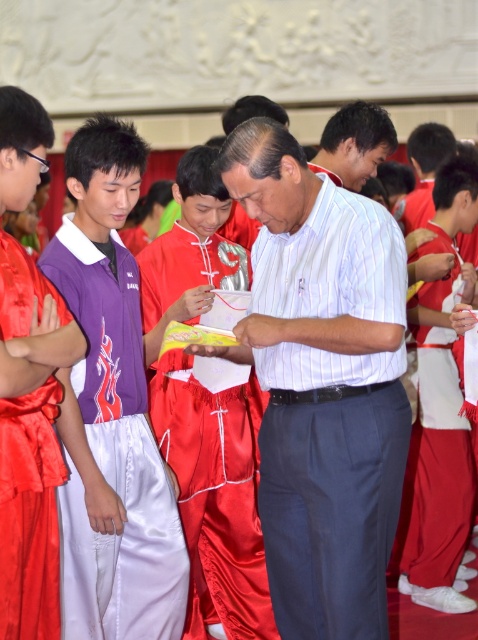
You are standing in the hall and want to take a photo of the point at coordinates (x=11, y=257). The camera you are using has a maximum focus range of 20 meters. Will the camera be able to focus on the point?

The point at coordinates (x=11, y=257) is 23.43 meters away from the camera, which exceeds the camera maximum focus range of 20 meters. Therefore, the camera will not be able to focus on the point.

You are a photographer positioned at the back of the hall. You want to capture a photo of both the silky red robe at left and the matte white shirt at center without any obstruction. Which object should you focus on first to ensure it appears sharp in the photo?

The silky red robe at left is closer to the viewer than the matte white shirt at center, so you should focus on the silky red robe at left first to ensure it appears sharp. However, since the matte white shirt at center is farther away, you may need to adjust your focus or use a smaller aperture to keep both in focus.

Based on the coordinates provided in the scene, where is the white striped shirt at center located in the image?

The white striped shirt at center is located at the coordinates point (322, 385).